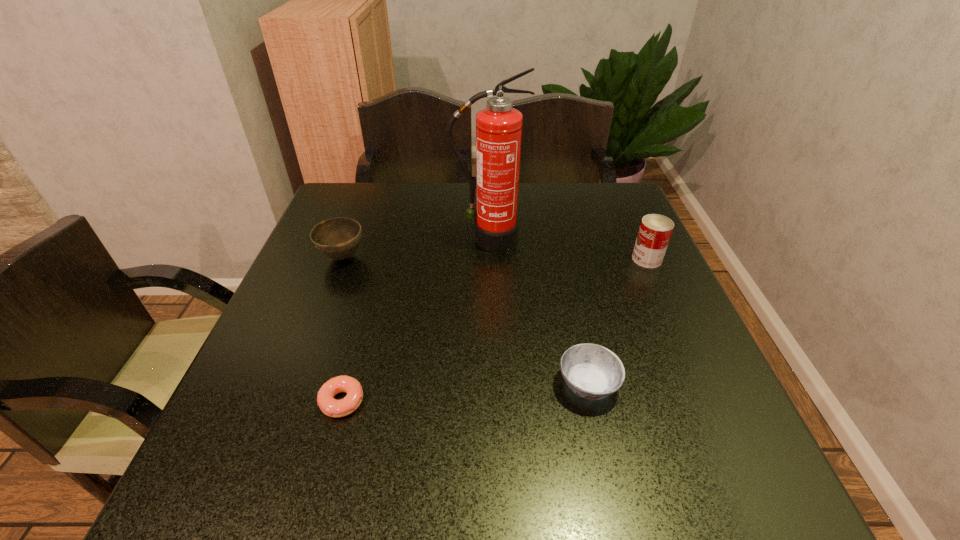
Find the location of a particular element. The image size is (960, 540). fire extinguisher is located at coordinates tap(498, 126).

The width and height of the screenshot is (960, 540). Identify the location of the tallest object. (498, 126).

Locate an element on the screen. This screenshot has height=540, width=960. the second tallest object is located at coordinates (655, 231).

Identify the location of can. The width and height of the screenshot is (960, 540). (655, 231).

This screenshot has height=540, width=960. Find the location of `bowl`. bowl is located at coordinates (338, 238).

The image size is (960, 540). In order to click on the fourth object from left to right in this screenshot , I will do `click(591, 371)`.

You are a GUI agent. You are given a task and a screenshot of the screen. Output one action in this format:
    pyautogui.click(x=<x>, y=<y>)
    Task: Click on the ashtray
    This screenshot has width=960, height=540.
    Given the screenshot: What is the action you would take?
    pyautogui.click(x=591, y=371)

Where is `doughnut`? doughnut is located at coordinates (329, 406).

In order to click on vacant space located 0.160m on the front-facing side of the tallest object in this screenshot , I will do `click(489, 295)`.

Locate an element on the screen. The image size is (960, 540). vacant space located on the front label of the rightmost object is located at coordinates (546, 259).